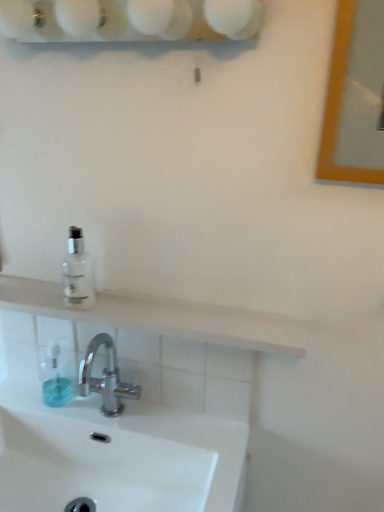
Find the location of a particular element. free space above white matte shelf at upper center (from a real-world perspective) is located at coordinates (147, 303).